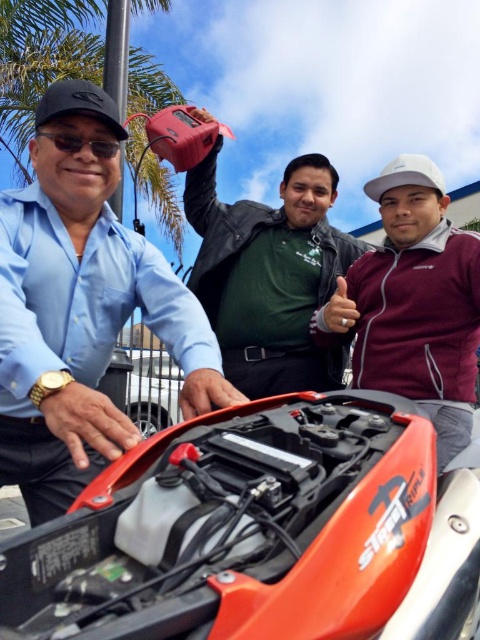
This screenshot has height=640, width=480. In order to click on orange matte motorcycle at center in this screenshot , I will do `click(260, 532)`.

The image size is (480, 640). What do you see at coordinates (260, 532) in the screenshot?
I see `orange matte motorcycle at center` at bounding box center [260, 532].

Does point (231, 488) lie in front of point (20, 353)?

Yes, point (231, 488) is in front of point (20, 353).

At what (x,y) coordinates should I click in order to perform the action: click on orange matte motorcycle at center. Please return your answer as a coordinate pair (x, y). Looking at the image, I should click on (260, 532).

Which is in front, point (433, 449) or point (290, 358)?

Point (433, 449)

Who is higher up, orange matte motorcycle at center or green matte shirt at center?

Positioned higher is green matte shirt at center.

The height and width of the screenshot is (640, 480). Describe the element at coordinates (260, 532) in the screenshot. I see `orange matte motorcycle at center` at that location.

This screenshot has height=640, width=480. I want to click on orange matte motorcycle at center, so click(x=260, y=532).

Who is higher up, matte black shirt at left or green matte shirt at center?

green matte shirt at center is above.

Who is taller, matte black shirt at left or green matte shirt at center?

green matte shirt at center

Between point (84, 472) and point (252, 202), which one is positioned behind?

The point (252, 202) is more distant.

Identify the location of matte black shirt at left. Image resolution: width=480 pixels, height=640 pixels. (82, 307).